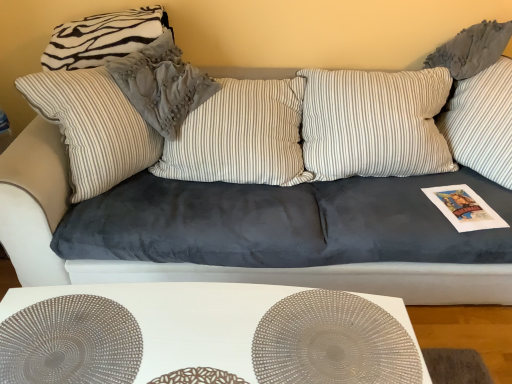
Question: Visually, is white matte table at lower center positioned to the left or to the right of striped fabric pillow at upper left, arranged as the second pillow when viewed from the left?

Choices:
 (A) left
 (B) right

Answer: (B)

Question: Is white matte table at lower center situated inside striped fabric pillow at upper left, arranged as the second pillow when viewed from the left, or outside?

Choices:
 (A) inside
 (B) outside

Answer: (B)

Question: Which of these objects is positioned closest to the satin silver circle at center, which is the first circle from left to right?

Choices:
 (A) zebra-patterned fabric pillow at upper left, which ranks as the second pillow in right-to-left order
 (B) translucent plastic circle at center, marked as the second circle in a left-to-right arrangement
 (C) white matte table at lower center
 (D) striped fabric pillow at upper left, which ranks as the 1th pillow in right-to-left order

Answer: (C)

Question: Which object is positioned farthest from the translucent plastic circle at center, the 1th circle positioned from the right?

Choices:
 (A) white matte table at lower center
 (B) striped fabric pillow at upper left, arranged as the second pillow when viewed from the left
 (C) zebra-patterned fabric pillow at upper left, which ranks as the second pillow in right-to-left order
 (D) satin silver circle at center, which is the first circle from left to right

Answer: (C)